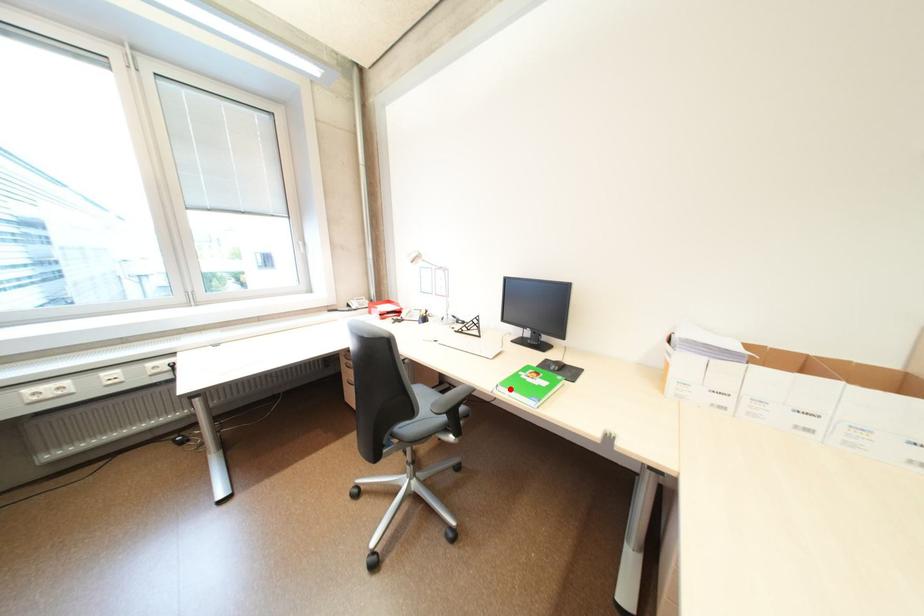
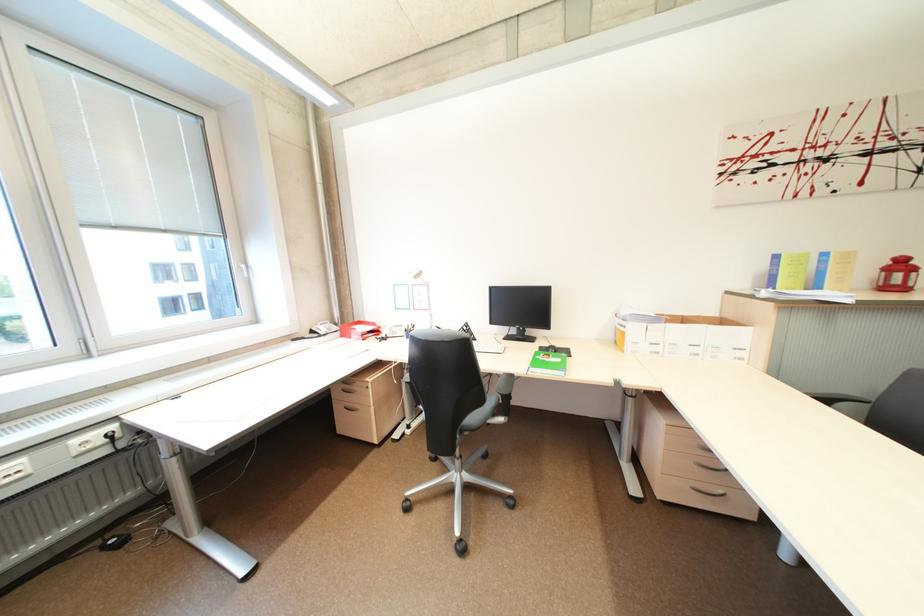
Question: I am providing you with two images of the same scene from different viewpoints. Given a red point in image1, look at the same physical point in image2. Is it:

Choices:
 (A) Closer to the viewpoint
 (B) Farther from the viewpoint

Answer: (B)